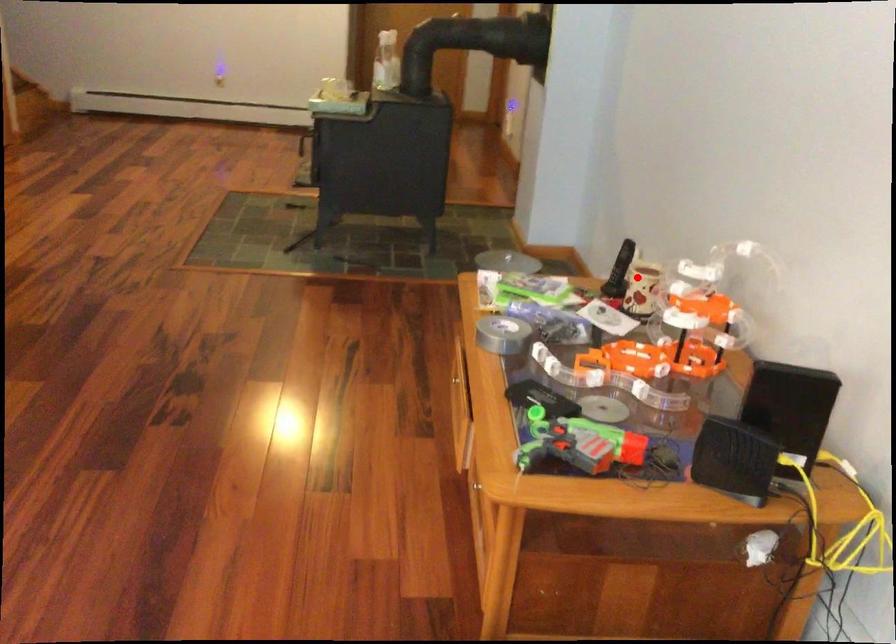
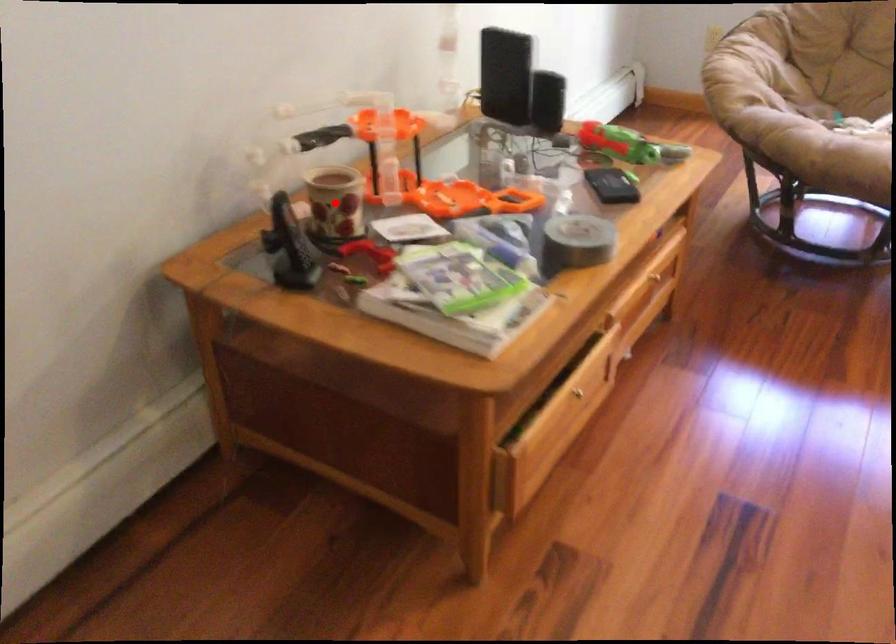
I am providing you with two images of the same scene from different viewpoints. A red point is marked on the first image and another point is marked on the second image. Is the red point in image1 aligned with the point shown in image2?

Yes